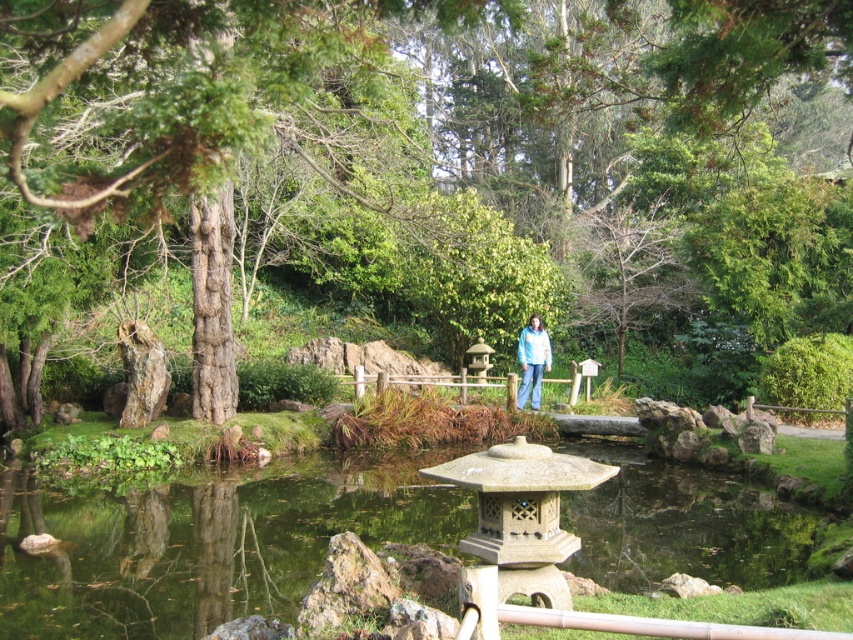
You are a visitor in the Japanese garden and want to retrieve your blue fabric jacket at center from the clear water at pond center. Can you reach the jacket without stepping into the water?

The clear water at pond center is positioned on the left side of blue fabric jacket at center, so you can reach the jacket by moving to the right side of the jacket and extending your arm towards the left to retrieve it without stepping into the water.

You are a visitor standing at the edge of the pond and want to take a photo of the green textured tree at center and the clear water at pond center. Which object will appear larger in your photo?

The green textured tree at center will appear larger in the photo because it is closer to the viewer than the clear water at pond center.

From the picture: You are a visitor standing at the edge of the pond in the Japanese garden. You see the clear water at pond center and the blue fabric jacket at center. Which object is closer to you?

The clear water at pond center is closer to the viewer than the blue fabric jacket at center.